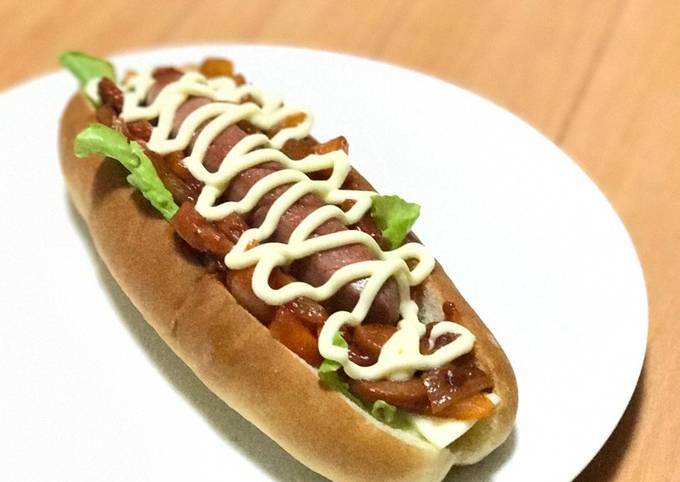
Identify the location of table. This screenshot has width=680, height=482. (619, 119).